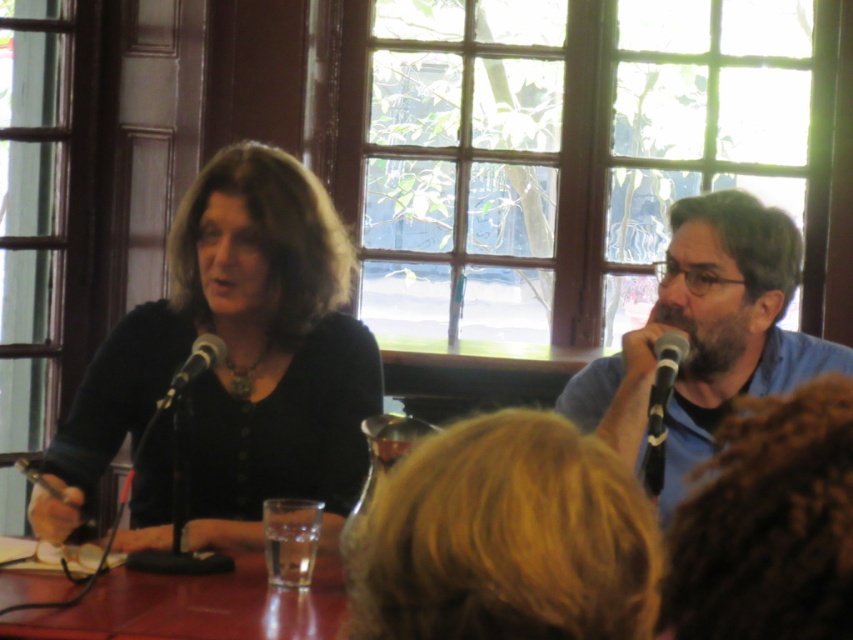
The width and height of the screenshot is (853, 640). What do you see at coordinates (236, 358) in the screenshot?
I see `matte black shirt at center` at bounding box center [236, 358].

Who is shorter, matte black shirt at center or black metallic microphone at left?

Standing shorter between the two is black metallic microphone at left.

Which is behind, point (241, 256) or point (198, 353)?

The point (241, 256) is more distant.

You are a GUI agent. You are given a task and a screenshot of the screen. Output one action in this format:
    pyautogui.click(x=<x>, y=<y>)
    Task: Click on the matte black shirt at center
    This screenshot has height=640, width=853.
    Given the screenshot: What is the action you would take?
    pyautogui.click(x=236, y=358)

How much distance is there between matte black shirt at center and black plastic microphone at right?

They are 89.80 centimeters apart.

Can you confirm if matte black shirt at center is shorter than black plastic microphone at right?

No, matte black shirt at center is not shorter than black plastic microphone at right.

Which is behind, point (378, 392) or point (656, 406)?

Positioned behind is point (378, 392).

Image resolution: width=853 pixels, height=640 pixels. I want to click on matte black shirt at center, so click(x=236, y=358).

Can you confirm if black plastic microphone at right is taller than black metallic microphone at left?

Indeed, black plastic microphone at right has a greater height compared to black metallic microphone at left.

Measure the distance between black plastic microphone at right and camera.

A distance of 2.18 meters exists between black plastic microphone at right and camera.

Is point (663, 358) positioned after point (161, 410)?

Yes, point (663, 358) is farther from viewer.

Identify the location of black plastic microphone at right. (x=664, y=380).